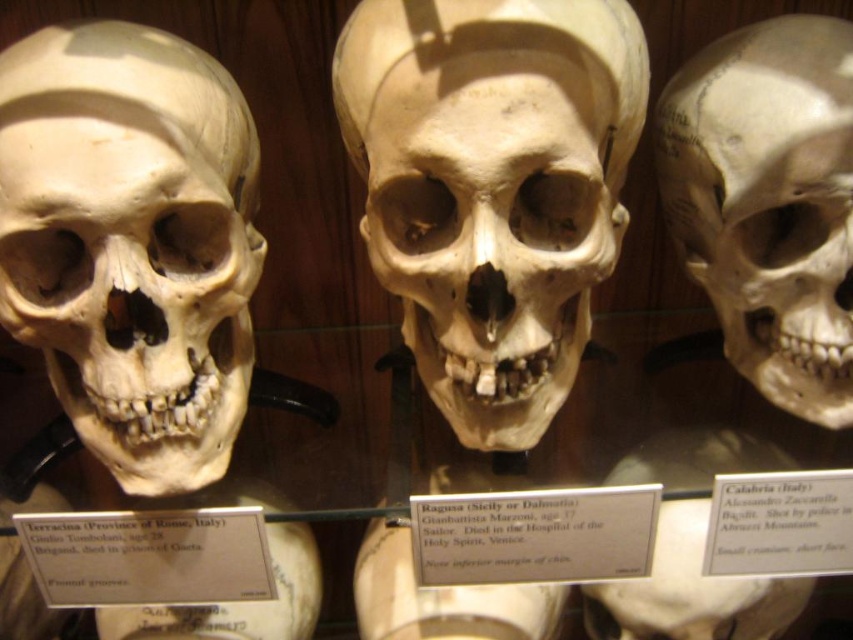
You are a museum curator arranging an exhibit. You need to place a new label between the matte white skull at right and the matte white skull at center. Which skull should the label be closer to if it must be positioned at the same height as the base of the taller skull?

The label should be closer to the matte white skull at right because it is taller than the matte white skull at center, so positioning the label at the base of the taller skull would require placing it near the matte white skull at right.

You are a museum visitor observing the matte white skull at right and the matte white skull at center. Which one is located to the right of the other?

The matte white skull at right is positioned on the right side of the matte white skull at center.